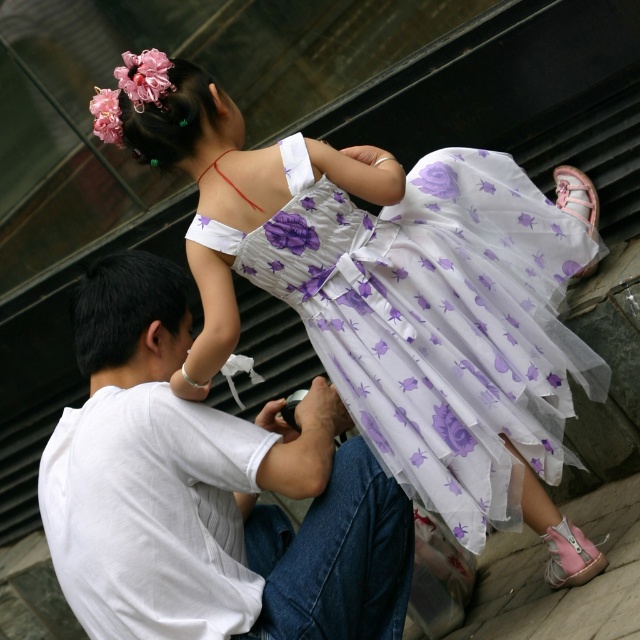
Does point (397, 273) lie behind point (100, 612)?

Yes, it is behind point (100, 612).

In the scene shown: Does translucent floral dress at upper center have a greater height compared to white cotton shirt at center?

Yes, translucent floral dress at upper center is taller than white cotton shirt at center.

Where is `translucent floral dress at upper center`? translucent floral dress at upper center is located at coordinates (390, 292).

At what (x,y) coordinates should I click in order to perform the action: click on translucent floral dress at upper center. Please return your answer as a coordinate pair (x, y). Looking at the image, I should click on pos(390,292).